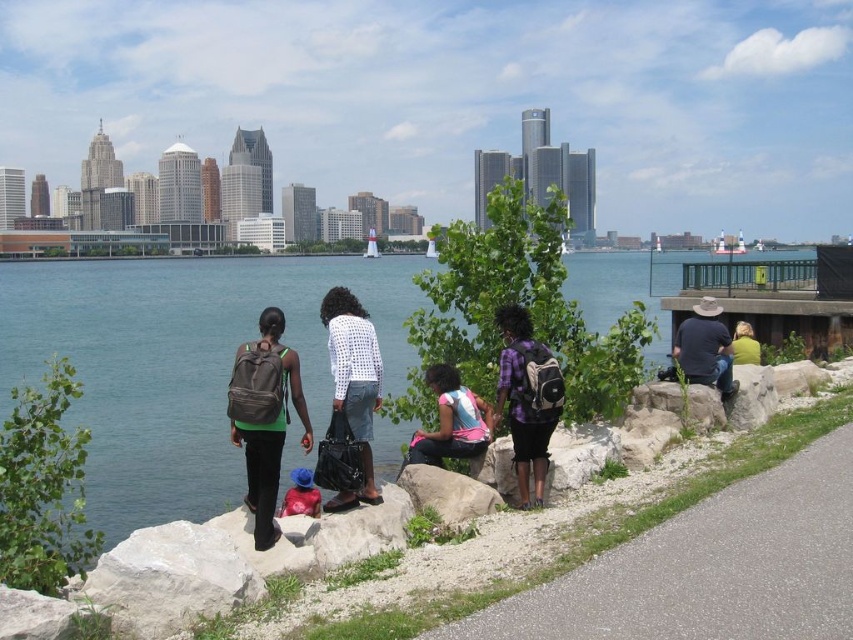
You are standing on the riverside pathway and want to pick up the blue denim jacket at lower center and the yellow fabric at upper right. Which item should you reach for first to grab both without moving your feet?

You should reach for the blue denim jacket at lower center first because it is closer to you than the yellow fabric at upper right, so you can grab it without moving your feet before reaching further for the other.

You are standing at the center of the paved pathway in the riverside scene. You want to locate the denim jacket at lower right. Which direction should you move to reach it?

The denim jacket at lower right is located at point 0.545 on the x axis and 0.828 on the y axis. Since you are at the center of the pathway, moving towards the lower right direction will lead you to the denim jacket at lower right.

You are a photographer standing at the camera position. You want to take a photo of both point (293,480) and point (756,348). Which point will appear larger in the photo?

Point (293,480) is closer to the camera than point (756,348), so it will appear larger in the photo.